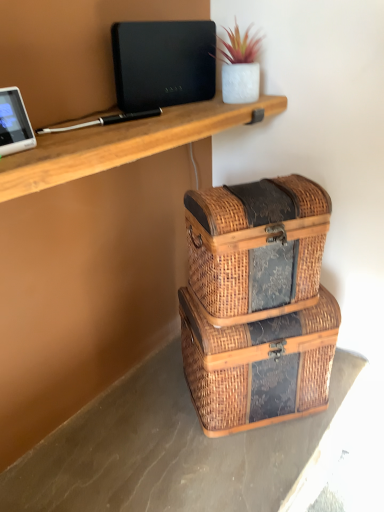
The height and width of the screenshot is (512, 384). Find the location of `space that is in front of woven wood storage box at lower center, the 2th storage box positioned from the top`. space that is in front of woven wood storage box at lower center, the 2th storage box positioned from the top is located at coordinates (246, 462).